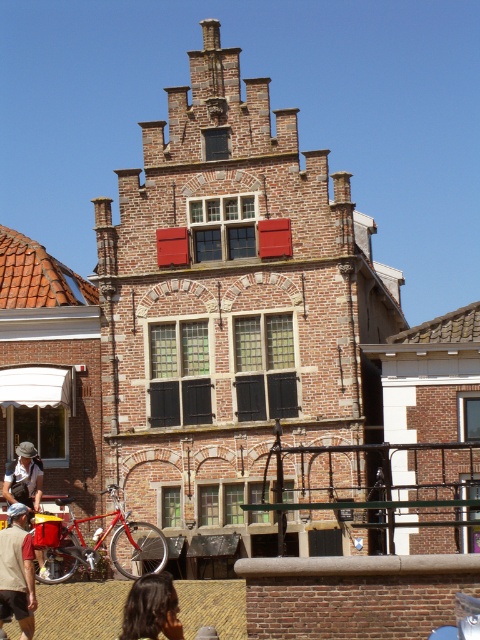
Question: Which object is farther from the camera taking this photo?

Choices:
 (A) matte red shutter at center
 (B) shiny red bicycle at lower left
 (C) white cotton shirt at lower left
 (D) red matte shutter at upper center

Answer: (D)

Question: Does black matte shutters at center come behind dark brown hair at lower left?

Choices:
 (A) yes
 (B) no

Answer: (A)

Question: Which point appears farthest from the camera in this image?

Choices:
 (A) (163, 253)
 (B) (122, 637)

Answer: (A)

Question: Does shiny red bicycle at lower left appear under matte red shutter at center?

Choices:
 (A) yes
 (B) no

Answer: (A)

Question: Is black matte shutters at center positioned at the back of tan cotton shirt at lower left?

Choices:
 (A) yes
 (B) no

Answer: (A)

Question: Estimate the real-world distances between objects in this image. Which object is closer to the green glass window at center?

Choices:
 (A) matte red shutter at center
 (B) red matte shutter at upper center
 (C) tan cotton shirt at lower left
 (D) dark brown hair at lower left

Answer: (B)